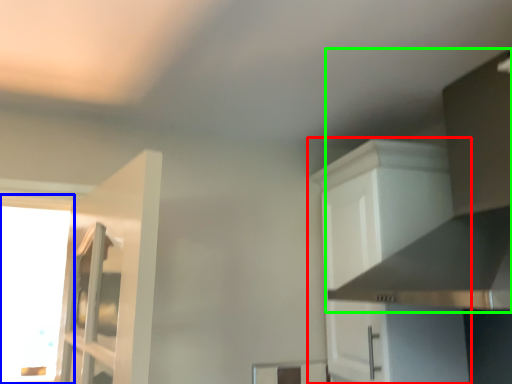
Question: Which object is the closest to the cabinetry (highlighted by a red box)? Choose among these: window (highlighted by a blue box) or vent (highlighted by a green box).

Choices:
 (A) window
 (B) vent

Answer: (B)